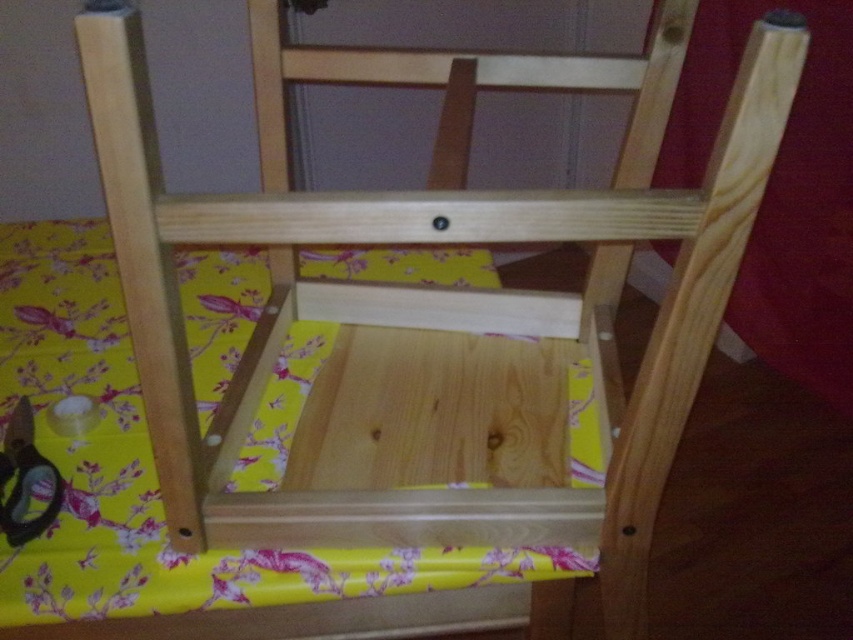
Is yellow floral fabric at center above metallic sheen scissors at lower left?

Yes, yellow floral fabric at center is above metallic sheen scissors at lower left.

From the picture: Measure the distance between yellow floral fabric at center and metallic sheen scissors at lower left.

The distance of yellow floral fabric at center from metallic sheen scissors at lower left is 21.30 centimeters.

Does point (569, 456) come farther from viewer compared to point (15, 536)?

Yes, it is.

The height and width of the screenshot is (640, 853). Find the location of `yellow floral fabric at center`. yellow floral fabric at center is located at coordinates (154, 472).